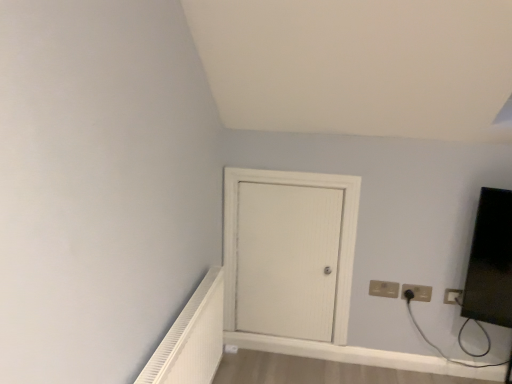
Identify the location of empty space that is ontop of white wood door at center (from a real-world perspective). (298, 166).